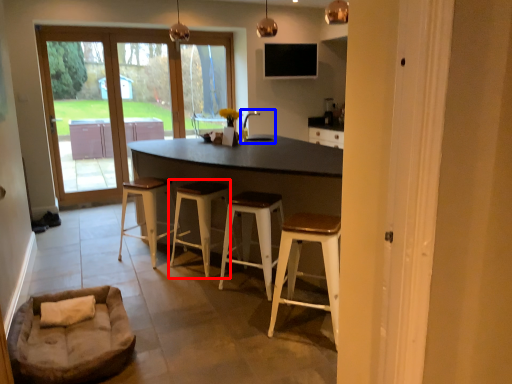
Question: Among these objects, which one is nearest to the camera, stool (highlighted by a red box) or sink (highlighted by a blue box)?

Choices:
 (A) stool
 (B) sink

Answer: (A)